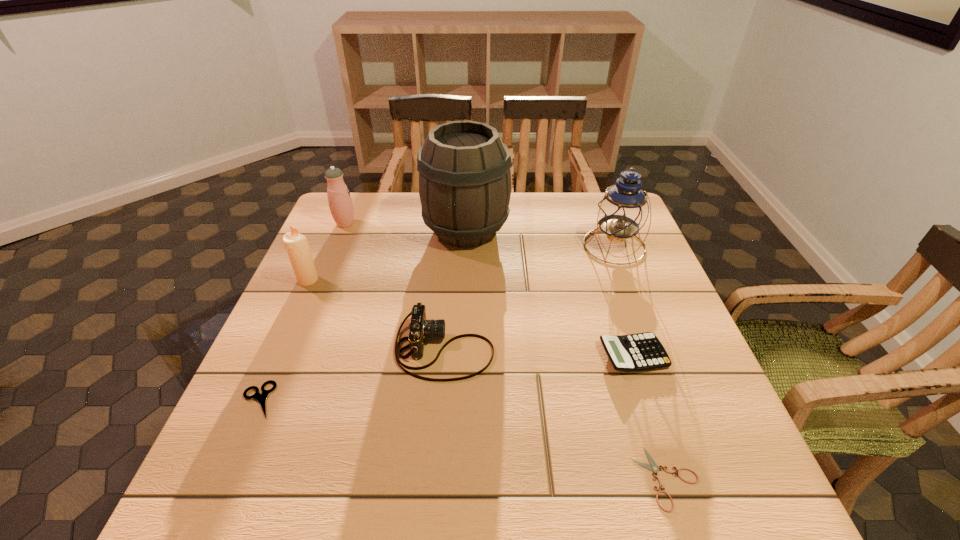
You are a GUI agent. You are given a task and a screenshot of the screen. Output one action in this format:
    pyautogui.click(x=<x>, y=<y>)
    Task: Click on the tallest object
    Image resolution: width=960 pixels, height=540 pixels.
    Given the screenshot: What is the action you would take?
    pyautogui.click(x=464, y=167)

The height and width of the screenshot is (540, 960). Find the location of `the second tallest object`. the second tallest object is located at coordinates (622, 212).

The width and height of the screenshot is (960, 540). Identify the location of thermos bottle. (340, 203).

Find the location of a particular element. The height and width of the screenshot is (540, 960). the fourth farthest object is located at coordinates (296, 244).

Image resolution: width=960 pixels, height=540 pixels. I want to click on camera, so click(x=420, y=329).

Where is `calculator`? calculator is located at coordinates (643, 351).

Locate an element on the screen. the left shears is located at coordinates (261, 398).

Locate an element on the screen. the taller shears is located at coordinates (261, 398).

Locate an element on the screen. The width and height of the screenshot is (960, 540). the shortest object is located at coordinates (653, 467).

The height and width of the screenshot is (540, 960). What are the coordinates of `the right shears` in the screenshot? It's located at click(x=653, y=467).